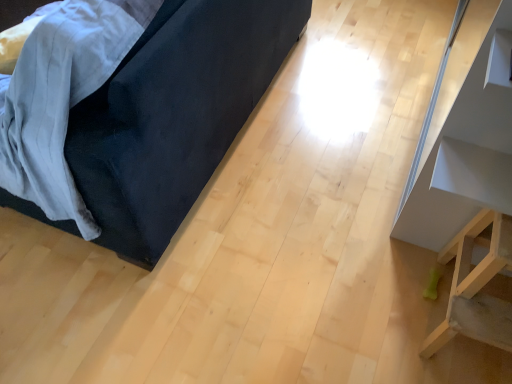
Question: Which is correct: white glossy shelf at upper right, marked as the 3th furniture in a left-to-right arrangement, is inside light wood stool at lower right, the second furniture from the left, or outside of it?

Choices:
 (A) outside
 (B) inside

Answer: (A)

Question: Visually, is white glossy shelf at upper right, positioned as the 1th furniture in right-to-left order, positioned to the left or to the right of light wood stool at lower right, the second furniture from the left?

Choices:
 (A) left
 (B) right

Answer: (B)

Question: Which of these objects is positioned farthest from the white glossy shelf at upper right, marked as the 3th furniture in a left-to-right arrangement?

Choices:
 (A) velvet dark blue couch at left, the first furniture when ordered from left to right
 (B) light wood stool at lower right, the second furniture viewed from the right

Answer: (A)

Question: Based on their relative distances, which object is nearer to the white glossy shelf at upper right, positioned as the 1th furniture in right-to-left order?

Choices:
 (A) light wood stool at lower right, the second furniture viewed from the right
 (B) velvet dark blue couch at left, the first furniture when ordered from left to right

Answer: (A)